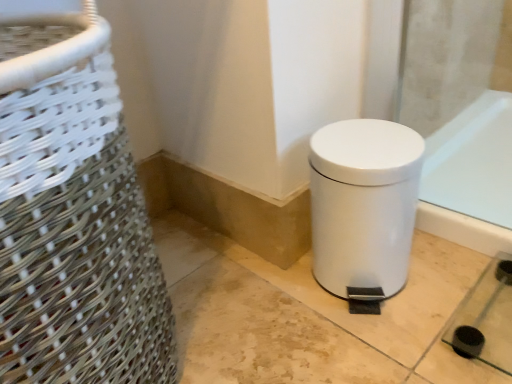
The height and width of the screenshot is (384, 512). What do you see at coordinates (73, 213) in the screenshot?
I see `white woven basket at left` at bounding box center [73, 213].

The width and height of the screenshot is (512, 384). Identify the location of white woven basket at left. (73, 213).

Measure the distance between white woven basket at left and camera.

10.96 inches.

Describe the element at coordinates (362, 206) in the screenshot. I see `white matte waste container at lower right` at that location.

At what (x,y) coordinates should I click in order to perform the action: click on white matte waste container at lower right. Please return your answer as a coordinate pair (x, y). Looking at the image, I should click on (362, 206).

In order to click on white woven basket at left in this screenshot , I will do `click(73, 213)`.

Based on the photo, does white matte waste container at lower right appear on the left side of white woven basket at left?

No, white matte waste container at lower right is not to the left of white woven basket at left.

Is white matte waste container at lower right positioned before white woven basket at left?

No, it is behind white woven basket at left.

Which point is more distant from viewer, (332,212) or (102,59)?

Positioned behind is point (332,212).

From the image's perspective, would you say white matte waste container at lower right is shown under white woven basket at left?

Correct, white matte waste container at lower right appears lower than white woven basket at left in the image.

Based on the photo, from a real-world perspective, relative to white woven basket at left, is white matte waste container at lower right vertically above or below?

Clearly, from a real-world perspective, white matte waste container at lower right is below white woven basket at left.

Can you confirm if white matte waste container at lower right is thinner than white woven basket at left?

Yes.

Who is taller, white matte waste container at lower right or white woven basket at left?

Standing taller between the two is white woven basket at left.

Can you confirm if white matte waste container at lower right is smaller than white woven basket at left?

Yes, white matte waste container at lower right is smaller than white woven basket at left.

Is white matte waste container at lower right situated inside white woven basket at left or outside?

white matte waste container at lower right exists outside the volume of white woven basket at left.

Is white matte waste container at lower right not close to white woven basket at left?

No, white matte waste container at lower right is in close proximity to white woven basket at left.

Is white matte waste container at lower right oriented towards white woven basket at left?

No, white matte waste container at lower right is not aimed at white woven basket at left.

Can you tell me how much white matte waste container at lower right and white woven basket at left differ in facing direction?

The angular difference between white matte waste container at lower right and white woven basket at left is 0.152 degrees.

Image resolution: width=512 pixels, height=384 pixels. I want to click on waste container that appears below the white woven basket at left (from the image's perspective), so click(362, 206).

Considering the relative positions of white woven basket at left and white matte waste container at lower right in the image provided, is white woven basket at left to the right of white matte waste container at lower right from the viewer's perspective?

In fact, white woven basket at left is to the left of white matte waste container at lower right.

Who is more distant, white woven basket at left or white matte waste container at lower right?

white matte waste container at lower right is behind.

Is point (38, 79) behind point (339, 280)?

No.

From the image's perspective, which one is positioned lower, white woven basket at left or white matte waste container at lower right?

white matte waste container at lower right appears lower in the image.

From a real-world perspective, which is physically above, white woven basket at left or white matte waste container at lower right?

white woven basket at left is physically above.

Which object is thinner, white woven basket at left or white matte waste container at lower right?

With smaller width is white matte waste container at lower right.

Can you confirm if white woven basket at left is shorter than white matte waste container at lower right?

No, white woven basket at left is not shorter than white matte waste container at lower right.

Considering the sizes of objects white woven basket at left and white matte waste container at lower right in the image provided, who is bigger, white woven basket at left or white matte waste container at lower right?

Bigger between the two is white woven basket at left.

Is white woven basket at left located outside white matte waste container at lower right?

white woven basket at left is positioned outside white matte waste container at lower right.

Is white woven basket at left directly adjacent to white matte waste container at lower right?

white woven basket at left and white matte waste container at lower right are clearly separated.

Consider the image. Is white woven basket at left oriented towards white matte waste container at lower right?

No.

Find the location of a particular element. The image size is (512, 384). basket container on the left of the white matte waste container at lower right is located at coordinates (73, 213).

At what (x,y) coordinates should I click in order to perform the action: click on waste container lying on the right of white woven basket at left. Please return your answer as a coordinate pair (x, y). Looking at the image, I should click on (362, 206).

Locate an element on the screen. The height and width of the screenshot is (384, 512). basket container on the left of white matte waste container at lower right is located at coordinates point(73,213).